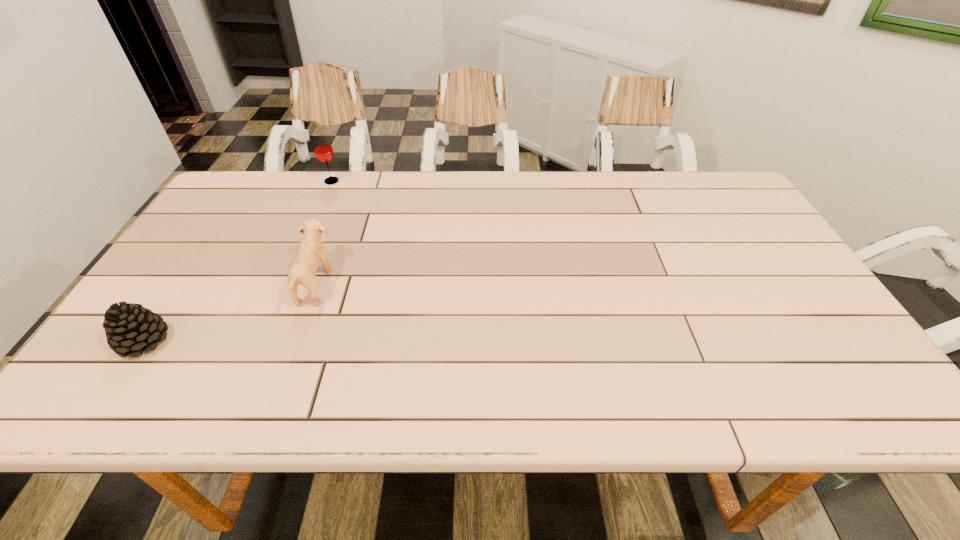
Locate an element on the screen. Image resolution: width=960 pixels, height=540 pixels. blank space at the far edge is located at coordinates (601, 192).

The image size is (960, 540). In order to click on vacant position at the near edge of the desktop in this screenshot , I will do `click(448, 390)`.

Where is `vacant space at the left edge`? Image resolution: width=960 pixels, height=540 pixels. vacant space at the left edge is located at coordinates tap(225, 237).

You are a GUI agent. You are given a task and a screenshot of the screen. Output one action in this format:
    pyautogui.click(x=<x>, y=<y>)
    Task: Click on the vacant region at the right edge of the desktop
    
    Given the screenshot: What is the action you would take?
    pyautogui.click(x=750, y=231)

Locate an element on the screen. This screenshot has width=960, height=540. vacant region at the far left corner is located at coordinates pyautogui.click(x=237, y=195).

This screenshot has width=960, height=540. I want to click on blank area at the near left corner, so 93,404.

Locate an element on the screen. The width and height of the screenshot is (960, 540). free space at the far right corner is located at coordinates (727, 198).

Image resolution: width=960 pixels, height=540 pixels. What are the coordinates of `free area in between the pinecone and the glass` in the screenshot? It's located at (238, 261).

Identify the location of free spot between the rightmost object and the pinecone. The image size is (960, 540). (x=229, y=313).

At what (x,y) coordinates should I click in order to perform the action: click on free space that is in between the pinecone and the puppy. Please return your answer as a coordinate pair (x, y). Image resolution: width=960 pixels, height=540 pixels. Looking at the image, I should click on (229, 313).